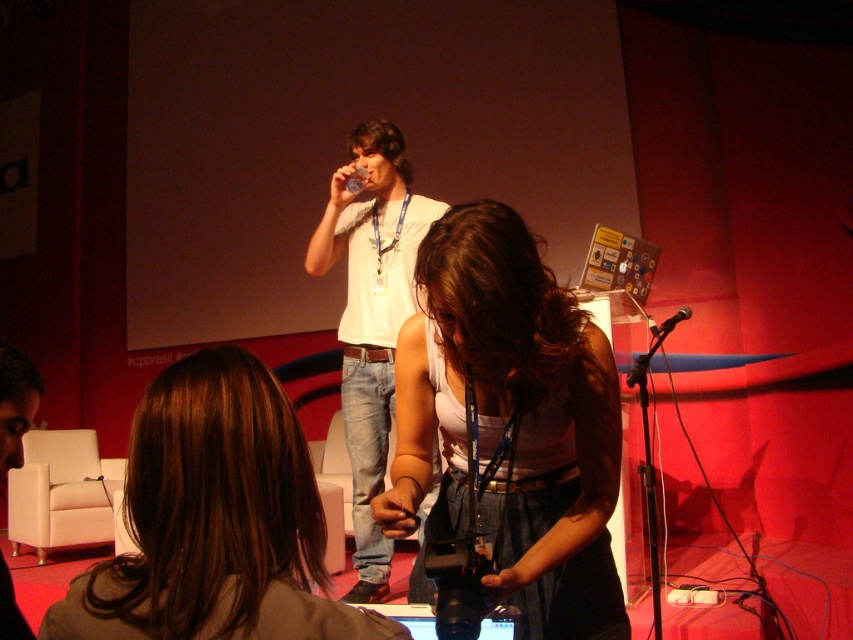
Does black plastic video camera at center appear on the left side of black plastic microphone at center?

Indeed, black plastic video camera at center is positioned on the left side of black plastic microphone at center.

You are a GUI agent. You are given a task and a screenshot of the screen. Output one action in this format:
    pyautogui.click(x=<x>, y=<y>)
    Task: Click on the black plastic video camera at center
    Image resolution: width=853 pixels, height=640 pixels.
    Given the screenshot: What is the action you would take?
    pyautogui.click(x=457, y=584)

Who is higher up, brown hair at center or white cotton shirt at center?

white cotton shirt at center is above.

Where is `brown hair at center`? brown hair at center is located at coordinates (215, 520).

Is point (257, 442) farther from viewer compared to point (405, 221)?

No.

Locate an element on the screen. This screenshot has height=640, width=853. brown hair at center is located at coordinates [215, 520].

Looking at this image, can you confirm if brown hair at center is smaller than black plastic video camera at center?

No, brown hair at center is not smaller than black plastic video camera at center.

Is brown hair at center further to the viewer compared to black plastic video camera at center?

No.

Which is behind, point (196, 620) or point (460, 576)?

Point (460, 576)

Where is `brown hair at center`? brown hair at center is located at coordinates (215, 520).